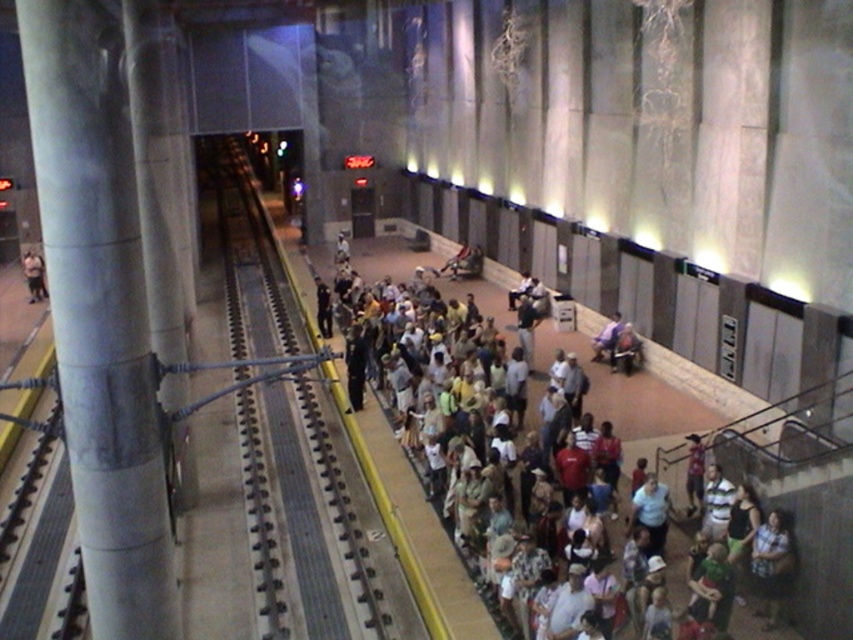
Question: Among these objects, which one is nearest to the camera?

Choices:
 (A) smooth concrete pillar at left
 (B) matte black backpack at left

Answer: (A)

Question: Does smooth metal track at center have a lesser width compared to matte black backpack at left?

Choices:
 (A) no
 (B) yes

Answer: (A)

Question: Among these points, which one is nearest to the camera?

Choices:
 (A) pos(36,284)
 (B) pos(659,381)
 (C) pos(248,449)
 (D) pos(73,22)

Answer: (D)

Question: Which of these objects is positioned farthest from the smooth metal track at center?

Choices:
 (A) smooth concrete pillar at left
 (B) white cotton shirt at center
 (C) matte black backpack at left

Answer: (A)

Question: Is the position of smooth concrete pillar at left more distant than that of matte black backpack at left?

Choices:
 (A) yes
 (B) no

Answer: (B)

Question: Does white cotton shirt at center have a greater width compared to matte black backpack at left?

Choices:
 (A) yes
 (B) no

Answer: (A)